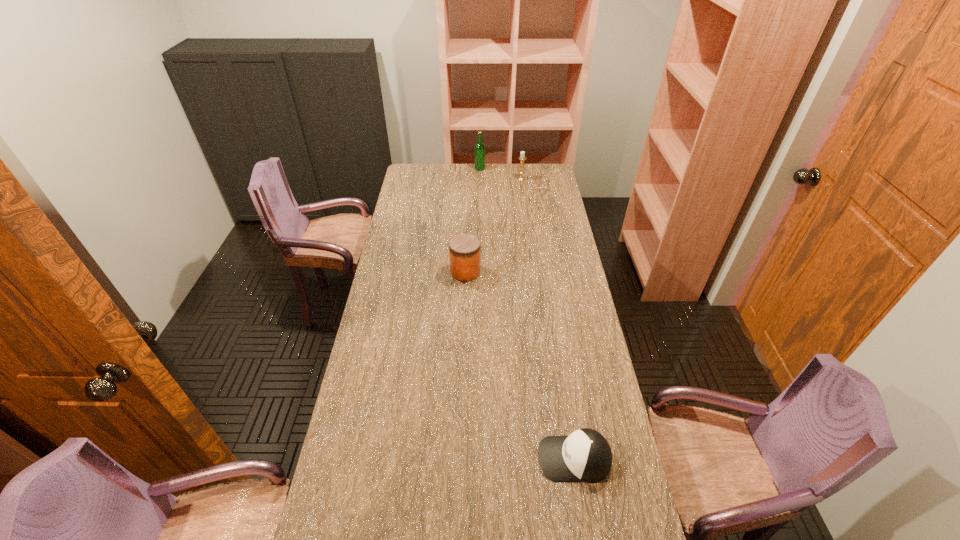
Where is `vacant space situated 0.260m on the front panel of the cap`? vacant space situated 0.260m on the front panel of the cap is located at coordinates (445, 458).

Find the location of a particular element. blank space located 0.120m on the front panel of the cap is located at coordinates (495, 458).

The height and width of the screenshot is (540, 960). Find the location of `beer bottle that is at the far edge`. beer bottle that is at the far edge is located at coordinates (479, 150).

Locate an element on the screen. candle holder that is at the far edge is located at coordinates (522, 157).

Where is `candle holder that is at the right edge`? candle holder that is at the right edge is located at coordinates (522, 157).

At what (x,y) coordinates should I click in order to perform the action: click on cap at the right edge. Please return your answer as a coordinate pair (x, y). Looking at the image, I should click on (585, 455).

At what (x,y) coordinates should I click in order to perform the action: click on object located in the far right corner section of the desktop. Please return your answer as a coordinate pair (x, y). The width and height of the screenshot is (960, 540). Looking at the image, I should click on (522, 157).

The height and width of the screenshot is (540, 960). In the image, there is a desktop. Identify the location of free space at the left edge. (420, 208).

Locate an element on the screen. Image resolution: width=960 pixels, height=540 pixels. vacant area at the right edge of the desktop is located at coordinates (553, 378).

The image size is (960, 540). In the image, there is a desktop. What are the coordinates of `free region at the far left corner` in the screenshot? It's located at (404, 178).